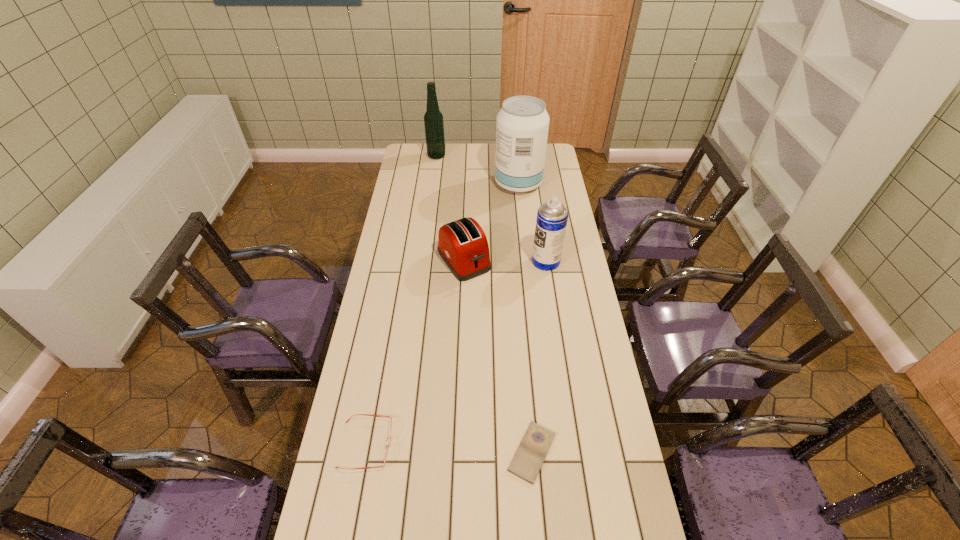
You are a GUI agent. You are given a task and a screenshot of the screen. Output one action in this format:
    pyautogui.click(x=<x>, y=<y>)
    Task: Click on the vacant area that lies between the third object from left to right and the fourth shortest object
    The height and width of the screenshot is (540, 960).
    Given the screenshot: What is the action you would take?
    pyautogui.click(x=505, y=261)

At what (x,y) coordinates should I click in order to perform the action: click on free point between the diary and the farther alcohol. Please return your answer as a coordinate pair (x, y). The width and height of the screenshot is (960, 540). Looking at the image, I should click on (484, 304).

Locate an element on the screen. This screenshot has height=540, width=960. free spot between the fifth tallest object and the fifth nearest object is located at coordinates pos(443,314).

Image resolution: width=960 pixels, height=540 pixels. Find the location of `vacant point located between the second farthest object and the fourth object from right to left`. vacant point located between the second farthest object and the fourth object from right to left is located at coordinates point(492,222).

The image size is (960, 540). I want to click on unoccupied area between the fifth tallest object and the fourth shortest object, so click(x=456, y=353).

Locate an element on the screen. This screenshot has width=960, height=540. vacant area that lies between the nearer alcohol and the fourth tallest object is located at coordinates (492, 222).

The image size is (960, 540). I want to click on empty space between the farthest object and the fourth object from right to left, so click(450, 208).

Locate which object is the second closest to the diary. Please provide its 2D coordinates. Your answer should be formatted as a tuple, i.e. [(x, y)], where the tuple contains the x and y coordinates of a point satisfying the conditions above.

[(462, 244)]

Identify the location of object that is the second closest to the spectacles. (462, 244).

The image size is (960, 540). In order to click on free spot that satisfies the following two spatial constraints: 1. on the front side of the nearer alcohol; 2. on the lenses of the spectacles in this screenshot , I will do `click(546, 444)`.